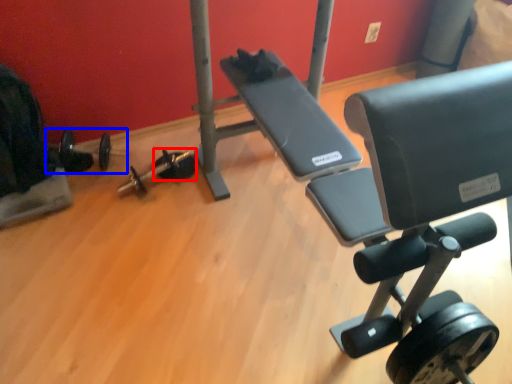
Question: Which object is further to the camera taking this photo, dumbbell (highlighted by a red box) or barbell (highlighted by a blue box)?

Choices:
 (A) dumbbell
 (B) barbell

Answer: (A)